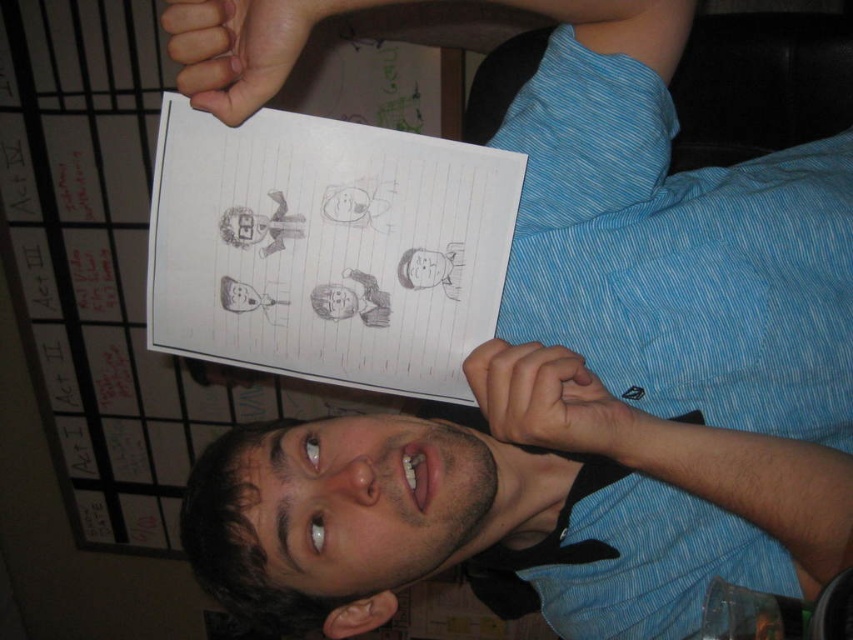
Question: Can you confirm if white lined paper at upper center is positioned to the right of dark brown hair at center?

Choices:
 (A) no
 (B) yes

Answer: (A)

Question: Which point appears closest to the camera in this image?

Choices:
 (A) (790, 451)
 (B) (312, 356)

Answer: (A)

Question: Which point is farther from the camera taking this photo?

Choices:
 (A) (790, 518)
 (B) (262, 262)

Answer: (B)

Question: Is white lined paper at upper center above dark brown hair at center?

Choices:
 (A) yes
 (B) no

Answer: (A)

Question: Considering the relative positions of matte blue shirt at center and white lined paper at upper center in the image provided, where is matte blue shirt at center located with respect to white lined paper at upper center?

Choices:
 (A) below
 (B) above

Answer: (A)

Question: Which point appears closest to the camera in this image?

Choices:
 (A) (323, 508)
 (B) (402, 256)

Answer: (A)